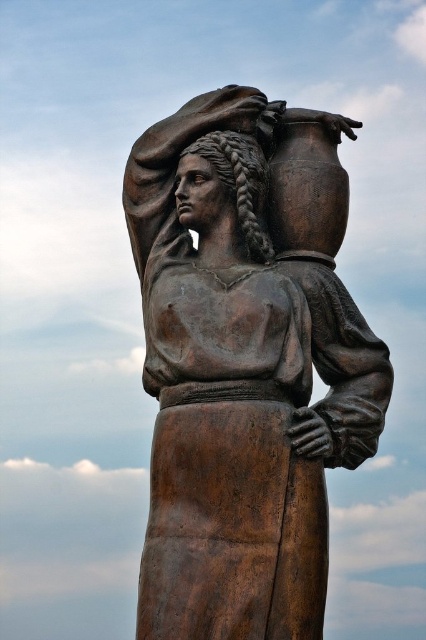
Question: Estimate the real-world distances between objects in this image. Which object is farther from the dark brown textured hair at upper center?

Choices:
 (A) bronze statue at center
 (B) bronze head at center

Answer: (A)

Question: Which object is the closest to the dark brown textured hair at upper center?

Choices:
 (A) bronze head at center
 (B) bronze statue at center

Answer: (A)

Question: Is bronze head at center to the right of dark brown textured hair at upper center from the viewer's perspective?

Choices:
 (A) yes
 (B) no

Answer: (B)

Question: Is bronze head at center wider than dark brown textured hair at upper center?

Choices:
 (A) yes
 (B) no

Answer: (A)

Question: Is bronze head at center positioned behind dark brown textured hair at upper center?

Choices:
 (A) no
 (B) yes

Answer: (B)

Question: Which point is farther to the camera?

Choices:
 (A) (265, 259)
 (B) (244, 204)

Answer: (A)